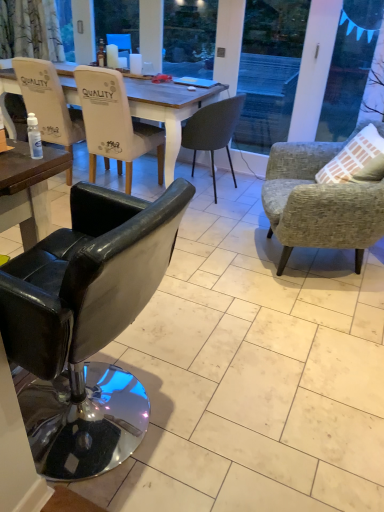
This screenshot has width=384, height=512. I want to click on vacant space to the right of black leather chair at left, arranged as the third chair when viewed from the right, so click(x=225, y=418).